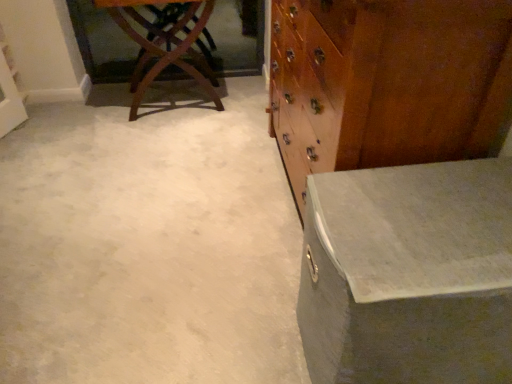
Question: From the image's perspective, is matte gray trunk at right, the 1th table from the right, on top of wooden chest of drawers at right?

Choices:
 (A) no
 (B) yes

Answer: (A)

Question: From a real-world perspective, is matte gray trunk at right, placed as the 2th table when sorted from top to bottom, below wooden chest of drawers at right?

Choices:
 (A) no
 (B) yes

Answer: (B)

Question: Would you consider matte gray trunk at right, which is the first table in front-to-back order, to be distant from wooden chest of drawers at right?

Choices:
 (A) no
 (B) yes

Answer: (A)

Question: Can you confirm if matte gray trunk at right, which is the first table in front-to-back order, is smaller than wooden chest of drawers at right?

Choices:
 (A) no
 (B) yes

Answer: (B)

Question: Can you confirm if matte gray trunk at right, arranged as the first table when ordered from the bottom, is thinner than wooden chest of drawers at right?

Choices:
 (A) yes
 (B) no

Answer: (B)

Question: From their relative heights in the image, would you say mahogany wood table at upper left, which ranks as the 1th table in left-to-right order, is taller or shorter than white concrete at center?

Choices:
 (A) short
 (B) tall

Answer: (B)

Question: Is mahogany wood table at upper left, which ranks as the 1th table in left-to-right order, to the left or to the right of white concrete at center in the image?

Choices:
 (A) right
 (B) left

Answer: (B)

Question: In the image, is mahogany wood table at upper left, acting as the second table starting from the bottom, positioned in front of or behind white concrete at center?

Choices:
 (A) front
 (B) behind

Answer: (B)

Question: Is mahogany wood table at upper left, which is the first table in top-to-bottom order, inside the boundaries of white concrete at center, or outside?

Choices:
 (A) inside
 (B) outside

Answer: (B)

Question: In the image, is wooden chest of drawers at right positioned in front of or behind matte gray trunk at right, which appears as the second table when viewed from the left?

Choices:
 (A) behind
 (B) front

Answer: (A)

Question: From a real-world perspective, is wooden chest of drawers at right above or below matte gray trunk at right, arranged as the first table when ordered from the bottom?

Choices:
 (A) above
 (B) below

Answer: (A)

Question: Does point (420, 145) appear closer or farther from the camera than point (404, 223)?

Choices:
 (A) closer
 (B) farther

Answer: (B)

Question: From the image's perspective, is wooden chest of drawers at right located above or below matte gray trunk at right, which is the first table in front-to-back order?

Choices:
 (A) above
 (B) below

Answer: (A)

Question: Considering the positions of white concrete at center and wooden chest of drawers at right in the image, is white concrete at center wider or thinner than wooden chest of drawers at right?

Choices:
 (A) thin
 (B) wide

Answer: (B)

Question: Relative to wooden chest of drawers at right, is white concrete at center in front or behind?

Choices:
 (A) front
 (B) behind

Answer: (B)